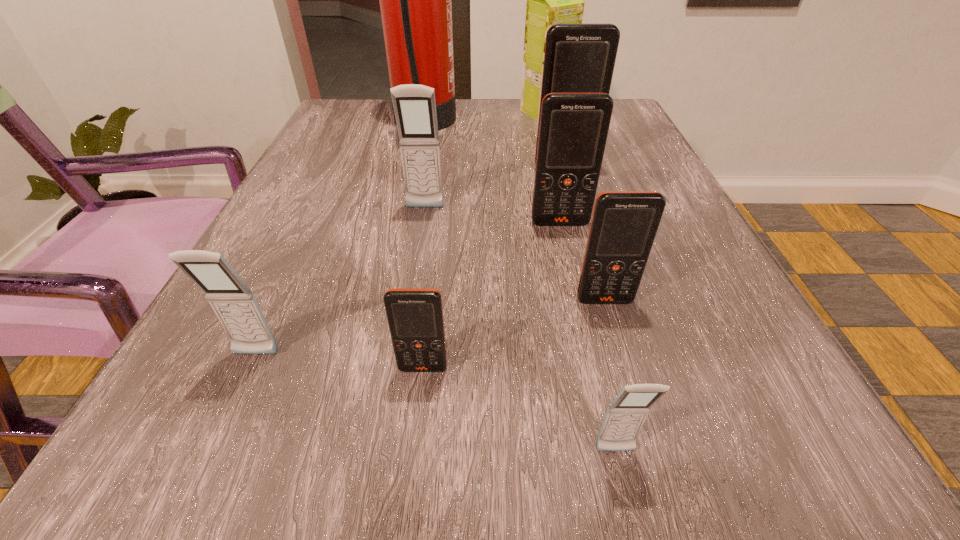
You are a GUI agent. You are given a task and a screenshot of the screen. Output one action in this format:
    pyautogui.click(x=<x>, y=<y>)
    Task: Click on the third nearest object
    This screenshot has height=540, width=960.
    Given the screenshot: What is the action you would take?
    pyautogui.click(x=236, y=307)

Locate an element on the screen. the sixth farthest object is located at coordinates (624, 224).

Locate an element on the screen. The image size is (960, 540). the second smallest orange cellular telephone is located at coordinates (624, 224).

This screenshot has height=540, width=960. I want to click on the eighth farthest object, so click(x=415, y=316).

Locate an element on the screen. the smallest orange cellular telephone is located at coordinates (415, 316).

The width and height of the screenshot is (960, 540). Find the location of `the smallest gray cellular telephone`. the smallest gray cellular telephone is located at coordinates (625, 416).

Where is `the nearest object`? The height and width of the screenshot is (540, 960). the nearest object is located at coordinates (625, 416).

Where is `vacant point located on the surface of the fire extinguisher`? The image size is (960, 540). vacant point located on the surface of the fire extinguisher is located at coordinates (485, 125).

I want to click on vacant space located 0.190m on the front of the green soya milk, so click(557, 161).

Locate an element on the screen. The image size is (960, 540). blank space located 0.090m on the screen of the farthest orange cellular telephone is located at coordinates (572, 199).